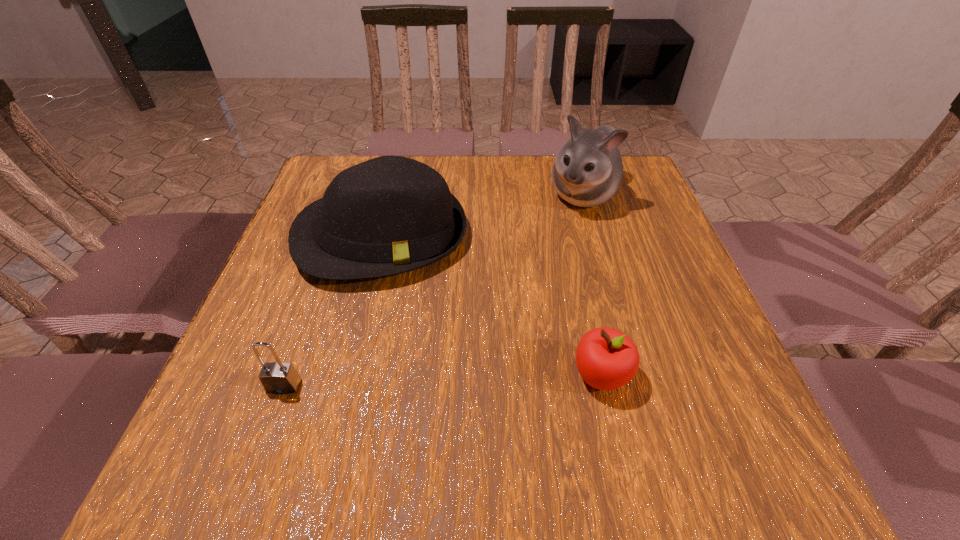
This screenshot has width=960, height=540. I want to click on object present at the far right corner, so click(588, 170).

The image size is (960, 540). In the image, there is a desktop. Identify the location of free space at the far edge. (550, 160).

I want to click on free space at the near edge of the desktop, so click(x=591, y=397).

Locate an element on the screen. The image size is (960, 540). free space at the right edge of the desktop is located at coordinates (645, 220).

Identify the location of free location at the far left corner. The image size is (960, 540). (342, 170).

Identify the location of unoccupied area between the tallest object and the apple. The height and width of the screenshot is (540, 960). (592, 285).

Locate an element on the screen. Image resolution: width=960 pixels, height=540 pixels. free space between the tallest object and the padlock is located at coordinates (433, 291).

The image size is (960, 540). In order to click on free spot between the apple and the padlock in this screenshot , I will do `click(443, 380)`.

Locate an element on the screen. The width and height of the screenshot is (960, 540). blank region between the apple and the hamster is located at coordinates (592, 285).

At what (x,y) coordinates should I click in order to perform the action: click on vacant area that lies between the padlock and the apple. Please return your answer as a coordinate pair (x, y). Looking at the image, I should click on (443, 380).